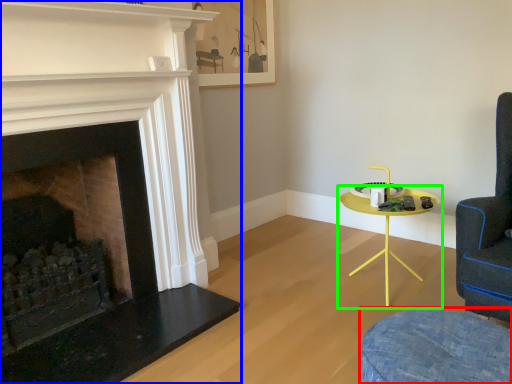
Question: Which is nearer to the swivel chair (highlighted by a red box)? fireplace (highlighted by a blue box) or table (highlighted by a green box).

Choices:
 (A) fireplace
 (B) table

Answer: (B)